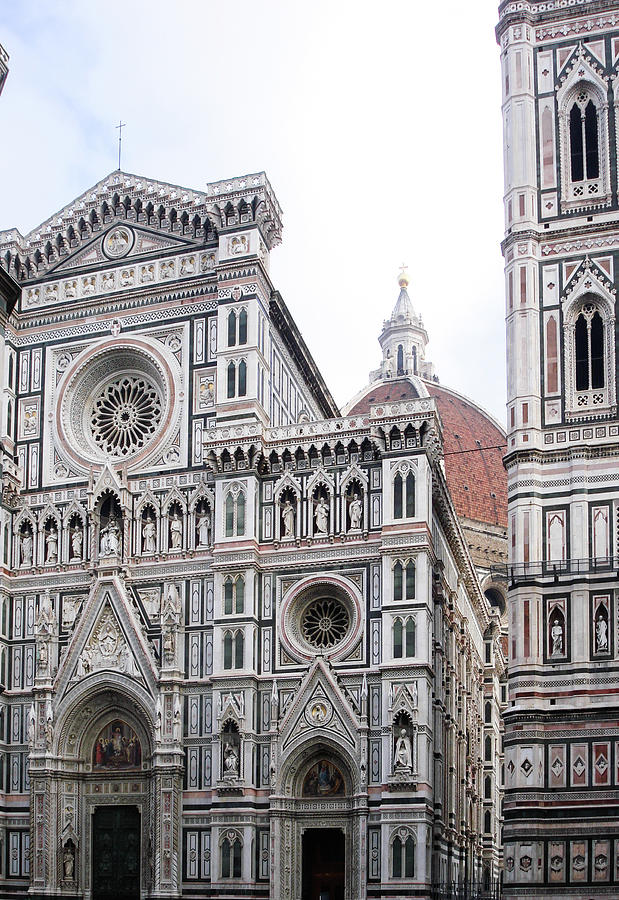
You are a GUI agent. You are given a task and a screenshot of the screen. Output one action in this format:
    pyautogui.click(x=<x>, y=<y>)
    Task: Click on the archways
    The height and width of the screenshot is (900, 619).
    Given the screenshot: What is the action you would take?
    pyautogui.click(x=110, y=699), pyautogui.click(x=319, y=752)